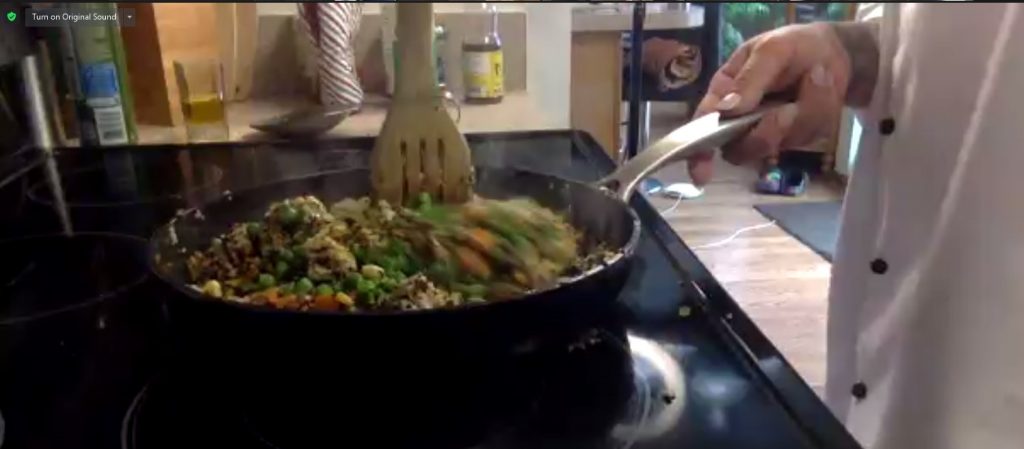
Identify the location of frying pan. Image resolution: width=1024 pixels, height=449 pixels. (273, 323), (597, 273), (527, 180), (273, 196).